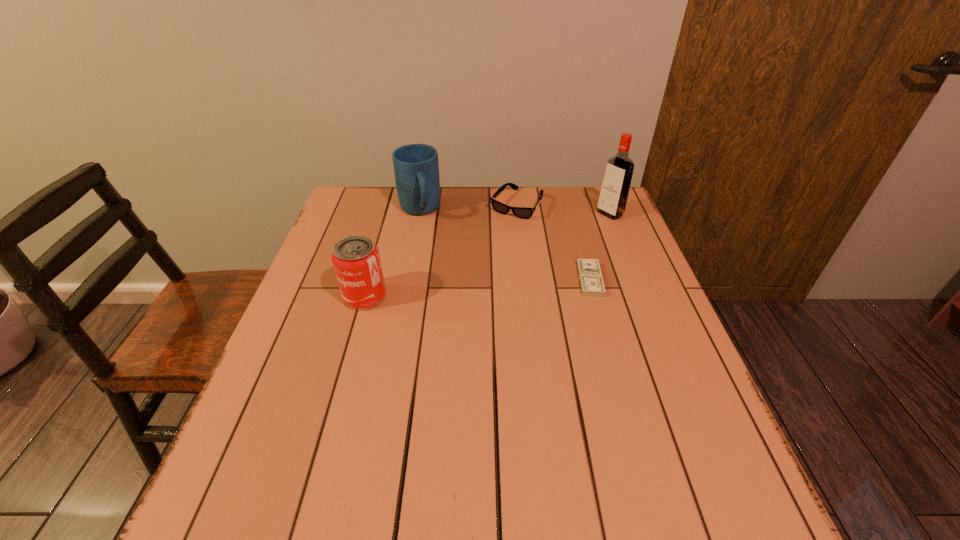
Find the location of a particular element. The height and width of the screenshot is (540, 960). blank region between the third shortest object and the fourth object from left to right is located at coordinates [x=477, y=288].

You are a GUI agent. You are given a task and a screenshot of the screen. Output one action in this format:
    pyautogui.click(x=<x>, y=<y>)
    Task: Click on the free spot between the sunglasses and the money
    The height and width of the screenshot is (540, 960).
    Given the screenshot: What is the action you would take?
    pyautogui.click(x=553, y=242)

At what (x,y) coordinates should I click in order to perform the action: click on empty space that is in between the money and the third object from left to right. Please return your answer as a coordinate pair (x, y). The width and height of the screenshot is (960, 540). Looking at the image, I should click on (553, 242).

Point out which object is positioned as the nearest to the fourth tallest object. Please provide its 2D coordinates. Your answer should be formatted as a tuple, i.e. [(x, y)], where the tuple contains the x and y coordinates of a point satisfying the conditions above.

[(416, 168)]

The height and width of the screenshot is (540, 960). I want to click on object that ranks as the fourth closest to the mug, so click(x=612, y=201).

Find the location of a particular element. This screenshot has height=540, width=960. vacant region that satisfies the following two spatial constraints: 1. on the front side of the second shortest object; 2. on the left side of the tallest object is located at coordinates (517, 214).

Find the location of a particular element. vacant space that satisfies the following two spatial constraints: 1. on the front side of the shortest object; 2. on the left side of the mug is located at coordinates (406, 280).

Identify the location of free point that satisfies the following two spatial constraints: 1. on the front side of the shortest object; 2. on the right side of the sunglasses. (525, 280).